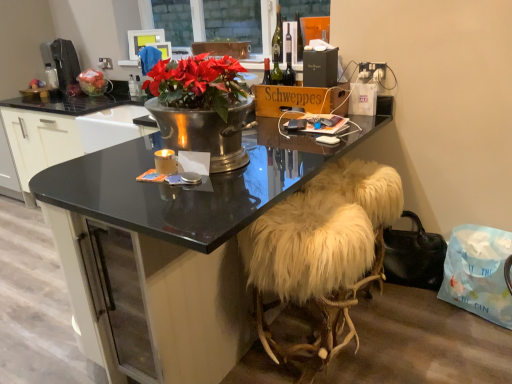
Question: From the image's perspective, is white fur stool at lower right above or below metallic silver sink at center?

Choices:
 (A) below
 (B) above

Answer: (A)

Question: Considering the positions of point (373, 236) and point (154, 130), is point (373, 236) closer or farther from the camera than point (154, 130)?

Choices:
 (A) closer
 (B) farther

Answer: (A)

Question: Considering the real-world distances, which object is closest to the matte plastic television at upper center?

Choices:
 (A) black glossy desk at center
 (B) metallic silver sink at center
 (C) black plastic coffee machine at left
 (D) black leather handbag at lower right
 (E) white plastic power outlet at upper center

Answer: (E)

Question: Which object is the closest to the black glossy desk at center?

Choices:
 (A) matte plastic bag of red apples at left
 (B) matte black bottle at upper center
 (C) white plastic power outlet at upper center
 (D) metallic silver sink at center
 (E) black plastic coffee machine at left

Answer: (D)